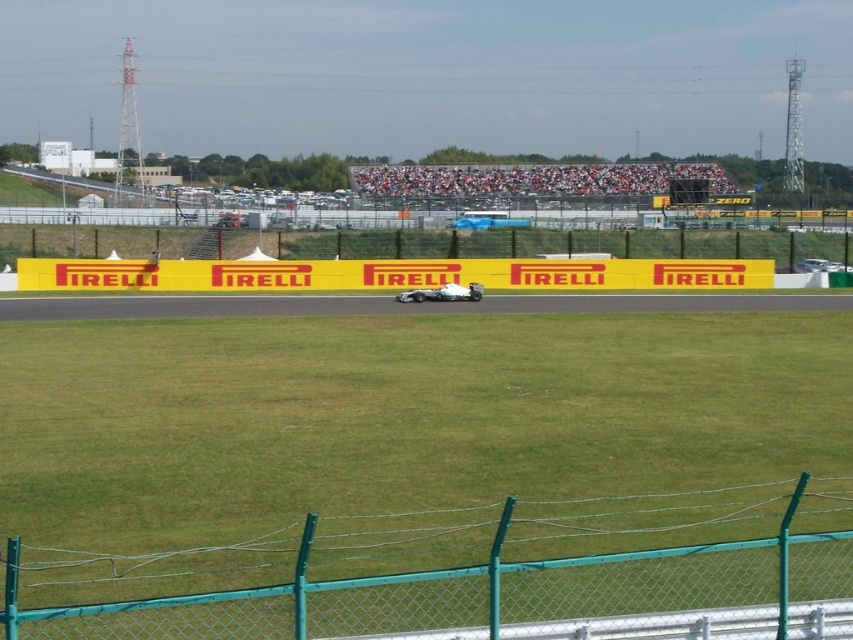
Question: Which point appears farthest from the camera in this image?

Choices:
 (A) (834, 563)
 (B) (401, 296)

Answer: (B)

Question: Can you confirm if green chain-link fence at lower center is positioned to the left of white matte race car at center?

Choices:
 (A) yes
 (B) no

Answer: (B)

Question: Does yellow/yellowish plastic banner at center have a smaller size compared to white matte race car at center?

Choices:
 (A) no
 (B) yes

Answer: (A)

Question: In this image, where is yellow/yellowish plastic banner at center located relative to white matte race car at center?

Choices:
 (A) below
 (B) above

Answer: (B)

Question: Which point is farther from the camera taking this photo?

Choices:
 (A) (705, 282)
 (B) (36, 621)

Answer: (A)

Question: Estimate the real-world distances between objects in this image. Which object is closer to the yellow/yellowish plastic banner at center?

Choices:
 (A) green chain-link fence at lower center
 (B) white matte race car at center

Answer: (B)